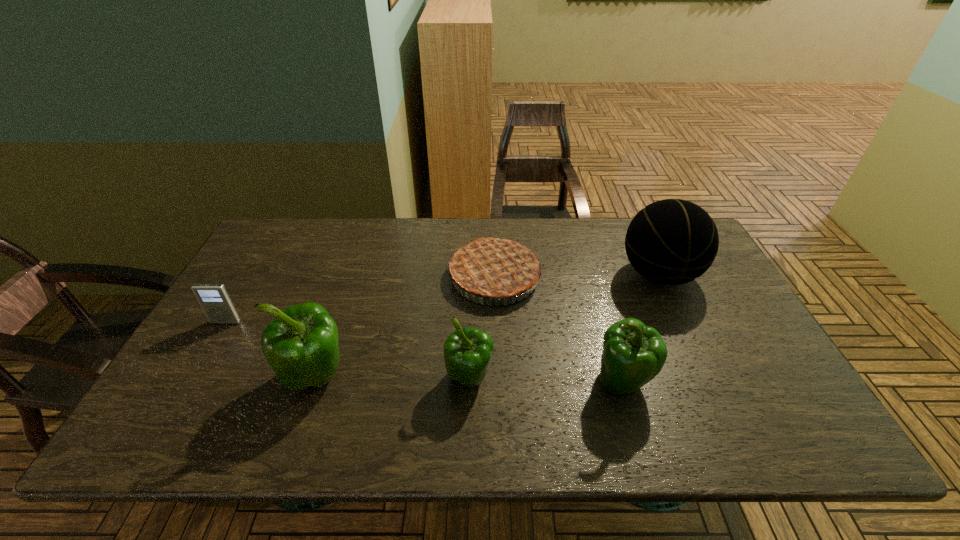
In the image, there is a desktop. At what (x,y) coordinates should I click in order to perform the action: click on blank space at the near edge. Please return your answer as a coordinate pair (x, y). The width and height of the screenshot is (960, 540). Looking at the image, I should click on (563, 400).

The width and height of the screenshot is (960, 540). In order to click on free space at the right edge of the desktop in this screenshot , I will do `click(706, 332)`.

Find the location of a particular element. The image size is (960, 540). vacant area that lies between the second object from left to right and the pie is located at coordinates (406, 326).

In order to click on unoccupied area between the leftmost bell pepper and the basketball in this screenshot , I will do `click(489, 326)`.

The width and height of the screenshot is (960, 540). I want to click on blank region between the pie and the shortest bell pepper, so click(482, 328).

Where is `vacant space in between the pie and the second bell pepper from right to left`? The image size is (960, 540). vacant space in between the pie and the second bell pepper from right to left is located at coordinates (482, 328).

This screenshot has width=960, height=540. Identify the location of vacant point located between the shortest bell pepper and the second object from left to right. [394, 378].

What are the coordinates of `blank region between the second shortest bell pepper and the iPod` in the screenshot? It's located at (424, 352).

In order to click on free point between the pie and the rightmost bell pepper in this screenshot , I will do `click(559, 329)`.

Where is `empty location between the rightmost bell pepper and the pie`? This screenshot has height=540, width=960. empty location between the rightmost bell pepper and the pie is located at coordinates (559, 329).